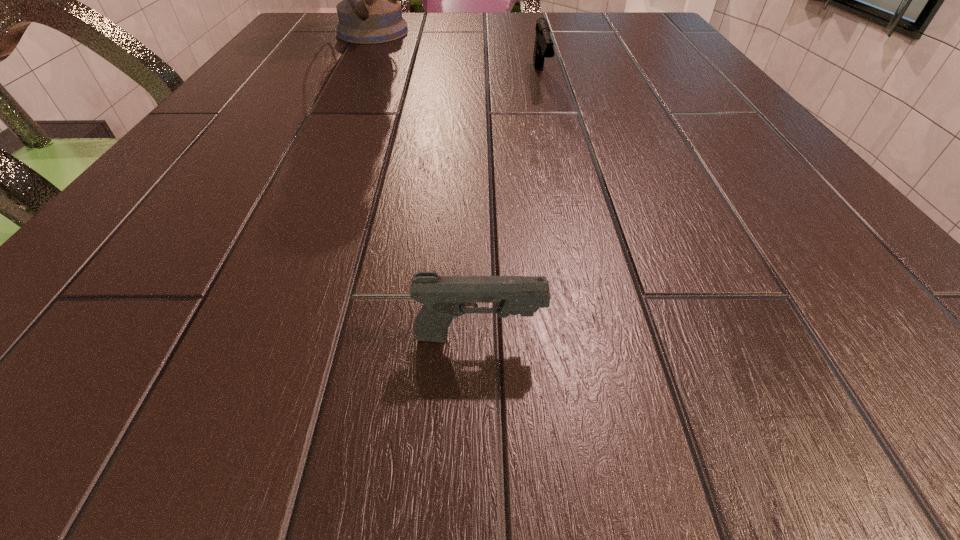
The width and height of the screenshot is (960, 540). I want to click on object at the near edge, so click(x=443, y=297).

Where is `object at the left edge`? This screenshot has height=540, width=960. object at the left edge is located at coordinates 369,12.

Locate an element on the screen. object that is at the far left corner is located at coordinates (369, 12).

At what (x,y) coordinates should I click in order to perform the action: click on free space at the far edge of the desktop. Please return your answer as a coordinate pair (x, y). Image resolution: width=960 pixels, height=540 pixels. Looking at the image, I should click on (474, 12).

What are the coordinates of `vacant space at the near edge of the desktop` in the screenshot? It's located at (720, 344).

This screenshot has width=960, height=540. Identify the location of vacant space at the left edge of the desktop. (198, 186).

In the image, there is a desktop. In order to click on vacant space at the right edge in this screenshot , I will do `click(691, 53)`.

What are the coordinates of `vacant space at the near left corner of the desktop` in the screenshot? It's located at [x=1, y=352].

The height and width of the screenshot is (540, 960). In the image, there is a desktop. Find the location of `free space at the far right corner`. free space at the far right corner is located at coordinates (613, 22).

Where is `empty location between the farther pistol and the leftmost object`? Image resolution: width=960 pixels, height=540 pixels. empty location between the farther pistol and the leftmost object is located at coordinates (455, 55).